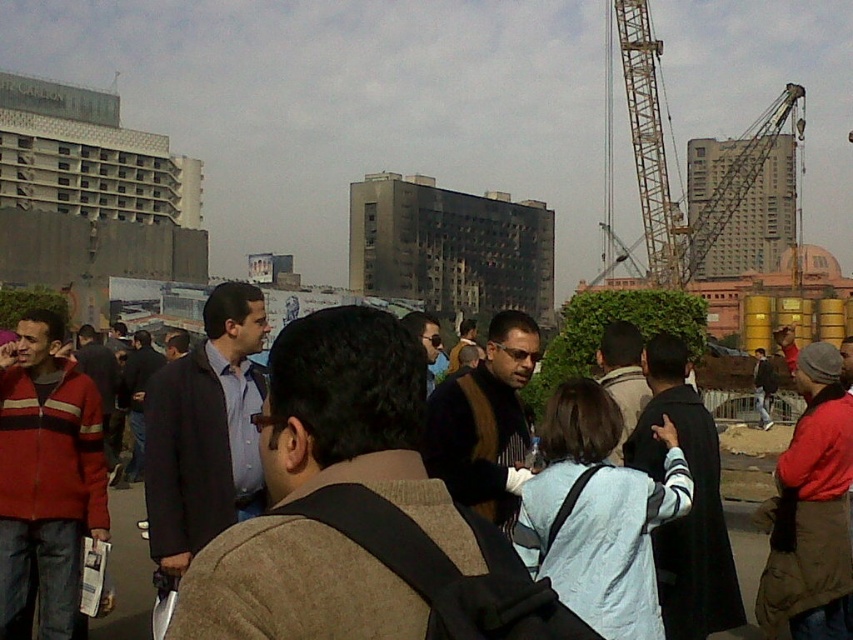
Which of these two, dark blue shirt at center or metallic gray crane at upper right, stands taller?

metallic gray crane at upper right

Is dark blue shirt at center closer to the viewer compared to metallic gray crane at upper right?

Yes, it is in front of metallic gray crane at upper right.

The height and width of the screenshot is (640, 853). What do you see at coordinates (206, 432) in the screenshot? I see `dark blue shirt at center` at bounding box center [206, 432].

Find the location of a particular element. The width and height of the screenshot is (853, 640). dark blue shirt at center is located at coordinates (206, 432).

Does red fleece jacket at left appear under dark blue shirt at center?

Indeed, red fleece jacket at left is positioned under dark blue shirt at center.

Is red fleece jacket at left further to the viewer compared to dark blue shirt at center?

No, it is in front of dark blue shirt at center.

Image resolution: width=853 pixels, height=640 pixels. What do you see at coordinates (45, 477) in the screenshot?
I see `red fleece jacket at left` at bounding box center [45, 477].

You are a GUI agent. You are given a task and a screenshot of the screen. Output one action in this format:
    pyautogui.click(x=<x>, y=<y>)
    Task: Click on the red fleece jacket at left
    The height and width of the screenshot is (640, 853).
    Given the screenshot: What is the action you would take?
    pyautogui.click(x=45, y=477)

Does red fleece jacket at left appear on the left side of light brown jacket at center?

Correct, you'll find red fleece jacket at left to the left of light brown jacket at center.

Measure the distance from red fleece jacket at left to light brown jacket at center.

They are 10.31 meters apart.

Which is in front, point (73, 634) or point (758, 458)?

Point (73, 634)

Image resolution: width=853 pixels, height=640 pixels. I want to click on red fleece jacket at left, so click(45, 477).